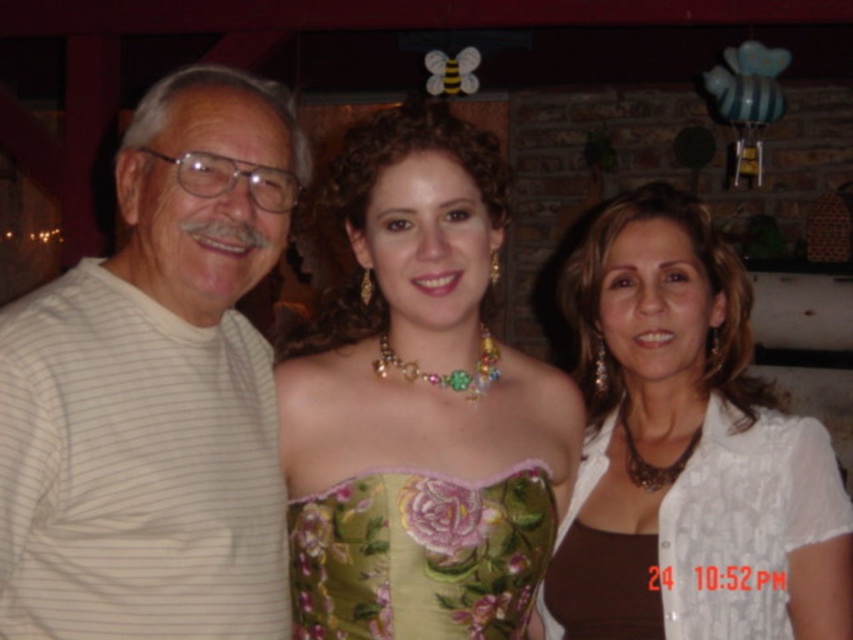
Question: Considering the relative positions of green floral dress at center and white lace blouse at center in the image provided, where is green floral dress at center located with respect to white lace blouse at center?

Choices:
 (A) right
 (B) left

Answer: (B)

Question: Which object is the closest to the white striped shirt at left?

Choices:
 (A) white lace blouse at center
 (B) green floral dress at center

Answer: (B)

Question: Which object appears farthest from the camera in this image?

Choices:
 (A) green floral dress at center
 (B) white striped shirt at left
 (C) white lace blouse at center

Answer: (C)

Question: Does green floral dress at center appear over white lace blouse at center?

Choices:
 (A) no
 (B) yes

Answer: (B)

Question: Which object is closer to the camera taking this photo?

Choices:
 (A) white lace blouse at center
 (B) white striped shirt at left
 (C) green floral dress at center

Answer: (B)

Question: Can you confirm if white striped shirt at left is positioned below white lace blouse at center?

Choices:
 (A) no
 (B) yes

Answer: (A)